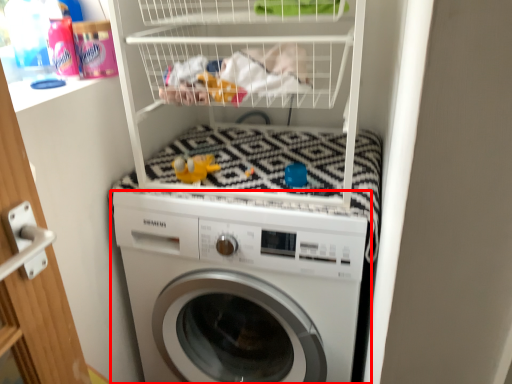
Question: Observing the image, what is the correct spatial positioning of washing machine (annotated by the red box) in reference to toy?

Choices:
 (A) right
 (B) left

Answer: (A)